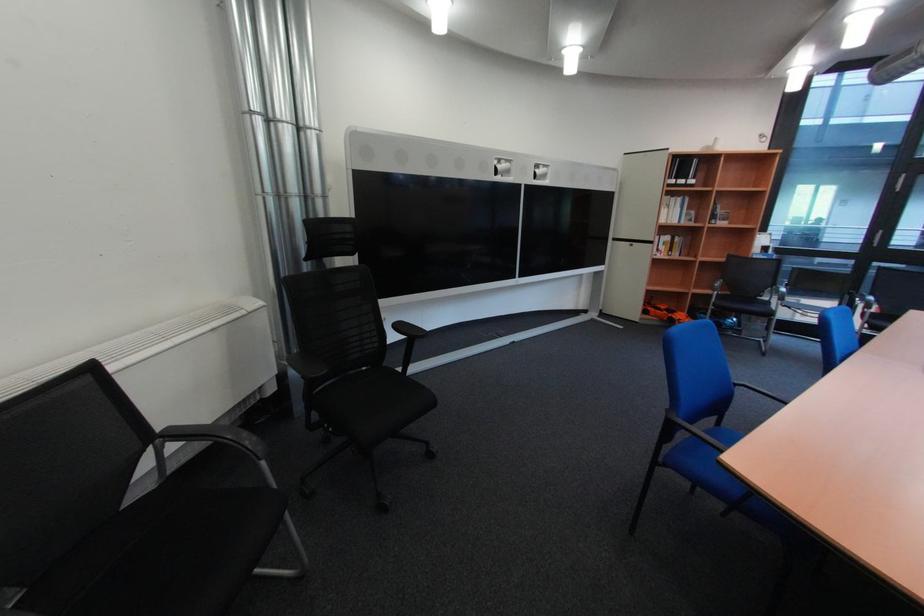
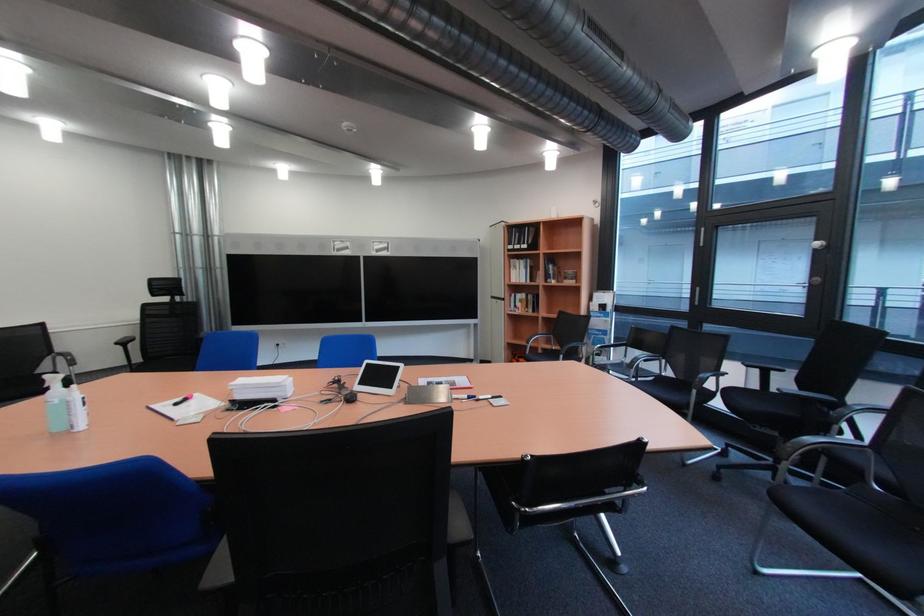
Question: The images are taken continuously from a first-person perspective. In which direction are you moving?

Choices:
 (A) Left
 (B) Right
 (C) Forward
 (D) Backward

Answer: (B)